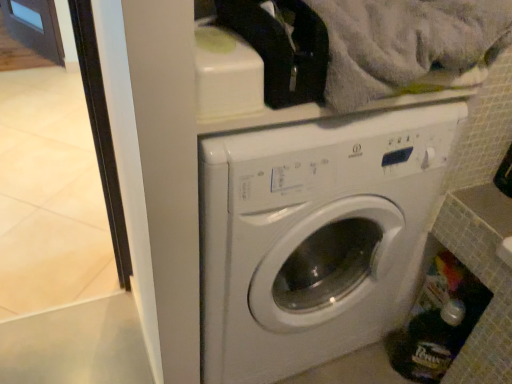
Question: From the image's perspective, is white glossy washing machine at center on translucent plastic bottle at lower right?

Choices:
 (A) yes
 (B) no

Answer: (A)

Question: Is white glossy washing machine at center shorter than translucent plastic bottle at lower right?

Choices:
 (A) no
 (B) yes

Answer: (A)

Question: Is white glossy washing machine at center facing away from translucent plastic bottle at lower right?

Choices:
 (A) yes
 (B) no

Answer: (B)

Question: Can we say white glossy washing machine at center lies outside translucent plastic bottle at lower right?

Choices:
 (A) yes
 (B) no

Answer: (A)

Question: Is white glossy washing machine at center to the right of translucent plastic bottle at lower right from the viewer's perspective?

Choices:
 (A) yes
 (B) no

Answer: (B)

Question: Can you confirm if white glossy washing machine at center is positioned to the left of translucent plastic bottle at lower right?

Choices:
 (A) no
 (B) yes

Answer: (B)

Question: Does translucent plastic bottle at lower right lie in front of white glossy washing machine at center?

Choices:
 (A) yes
 (B) no

Answer: (B)

Question: From a real-world perspective, is translucent plastic bottle at lower right physically above white glossy washing machine at center?

Choices:
 (A) no
 (B) yes

Answer: (A)

Question: Does translucent plastic bottle at lower right turn towards white glossy washing machine at center?

Choices:
 (A) yes
 (B) no

Answer: (B)

Question: Can you confirm if translucent plastic bottle at lower right is positioned to the right of white glossy washing machine at center?

Choices:
 (A) no
 (B) yes

Answer: (B)

Question: From the image's perspective, is translucent plastic bottle at lower right over white glossy washing machine at center?

Choices:
 (A) no
 (B) yes

Answer: (A)

Question: From a real-world perspective, is translucent plastic bottle at lower right located beneath white glossy washing machine at center?

Choices:
 (A) yes
 (B) no

Answer: (A)

Question: From the image's perspective, is white glossy washing machine at center above or below translucent plastic bottle at lower right?

Choices:
 (A) below
 (B) above

Answer: (B)